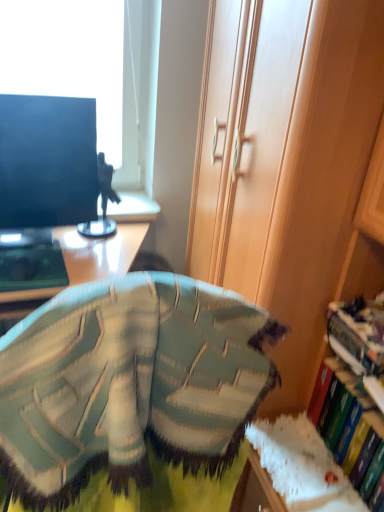
You are a GUI agent. You are given a task and a screenshot of the screen. Output one action in this format:
    pyautogui.click(x=<x>, y=<y>)
    Task: Click on the green knitted bean bag chair at center
    
    Given the screenshot: What is the action you would take?
    [x=132, y=396]

Where is `hardcover book at right, which is the 1th book in bottom-to-top order`? hardcover book at right, which is the 1th book in bottom-to-top order is located at coordinates (343, 409).

This screenshot has height=512, width=384. I want to click on green knitted bean bag chair at center, so click(x=132, y=396).

Locate an element on the screen. television behind the hardcover book at right, the second book when ordered from top to bottom is located at coordinates (47, 161).

Does matte black monitor at left have a smaller size compared to hardcover book at right, which is the 1th book in bottom-to-top order?

Actually, matte black monitor at left might be larger than hardcover book at right, which is the 1th book in bottom-to-top order.

Which is more to the left, matte black monitor at left or hardcover book at right, which is the 1th book in bottom-to-top order?

Positioned to the left is matte black monitor at left.

Which object is thinner, matte black monitor at left or hardcover book at right, the second book when ordered from top to bottom?

matte black monitor at left.

Considering the relative sizes of green knitted bean bag chair at center and matte black monitor at left in the image provided, is green knitted bean bag chair at center bigger than matte black monitor at left?

Indeed, green knitted bean bag chair at center has a larger size compared to matte black monitor at left.

Which point is more distant from viewer, (168,291) or (35,242)?

The point (35,242) is behind.

Would you say green knitted bean bag chair at center is outside matte black monitor at left?

Yes.

Which object is positioned more to the left, green knitted bean bag chair at center or matte black monitor at left?

matte black monitor at left.

Does wooden cabinet at right have a greater width compared to hardcover book at right, the first book positioned from the top?

Yes, wooden cabinet at right is wider than hardcover book at right, the first book positioned from the top.

Is point (300, 256) farther from viewer compared to point (363, 325)?

Yes, it is behind point (363, 325).

In terms of size, does wooden cabinet at right appear bigger or smaller than hardcover book at right, acting as the second book starting from the bottom?

Clearly, wooden cabinet at right is larger in size than hardcover book at right, acting as the second book starting from the bottom.

Is wooden cabinet at right positioned beyond the bounds of hardcover book at right, the first book positioned from the top?

That's correct, wooden cabinet at right is outside of hardcover book at right, the first book positioned from the top.

Looking at their sizes, would you say wooden cabinet at right is wider or thinner than green knitted bean bag chair at center?

wooden cabinet at right is wider than green knitted bean bag chair at center.

Does point (358, 250) lie in front of point (128, 419)?

That is False.

Is wooden cabinet at right turned away from green knitted bean bag chair at center?

Yes, wooden cabinet at right's orientation is away from green knitted bean bag chair at center.

From the image's perspective, is wooden cabinet at right above green knitted bean bag chair at center?

Yes, from the image's perspective, wooden cabinet at right is above green knitted bean bag chair at center.

Is green knitted bean bag chair at center positioned with its back to wooden cabinet at right?

green knitted bean bag chair at center is not turned away from wooden cabinet at right.

Would you say green knitted bean bag chair at center is outside wooden cabinet at right?

Yes, green knitted bean bag chair at center is not within wooden cabinet at right.

At what (x,y) coordinates should I click in order to perform the action: click on cabinetry on the right of the green knitted bean bag chair at center. Please return your answer as a coordinate pair (x, y). The height and width of the screenshot is (512, 384). Looking at the image, I should click on (324, 191).

Can you confirm if green knitted bean bag chair at center is positioned to the right of wooden cabinet at right?

In fact, green knitted bean bag chair at center is to the left of wooden cabinet at right.

Based on the photo, would you say matte black monitor at left is a long distance from wooden cabinet at right?

No, matte black monitor at left is in close proximity to wooden cabinet at right.

Between matte black monitor at left and wooden cabinet at right, which one appears on the right side from the viewer's perspective?

From the viewer's perspective, wooden cabinet at right appears more on the right side.

Between matte black monitor at left and wooden cabinet at right, which one has larger size?

wooden cabinet at right is bigger.

Where is `television above the wooden cabinet at right (from the image's perspective)`? television above the wooden cabinet at right (from the image's perspective) is located at coordinates (47, 161).

From a real-world perspective, does hardcover book at right, the second book when ordered from top to bottom, stand above hardcover book at right, acting as the second book starting from the bottom?

Incorrect, from a real-world perspective, hardcover book at right, the second book when ordered from top to bottom, is lower than hardcover book at right, acting as the second book starting from the bottom.

Is hardcover book at right, the second book when ordered from top to bottom, placed right next to hardcover book at right, the first book positioned from the top?

They are not placed beside each other.

Which object is thinner, hardcover book at right, the second book when ordered from top to bottom, or hardcover book at right, acting as the second book starting from the bottom?

hardcover book at right, the second book when ordered from top to bottom.

Who is bigger, hardcover book at right, the second book when ordered from top to bottom, or hardcover book at right, acting as the second book starting from the bottom?

With larger size is hardcover book at right, the second book when ordered from top to bottom.

You are a GUI agent. You are given a task and a screenshot of the screen. Output one action in this format:
    pyautogui.click(x=<x>, y=<y>)
    Task: Click on the 2nd book in front of the matte black monitor at left
    This screenshot has width=384, height=512.
    Given the screenshot: What is the action you would take?
    pyautogui.click(x=343, y=409)

You are a GUI agent. You are given a task and a screenshot of the screen. Output one action in this format:
    pyautogui.click(x=<x>, y=<y>)
    Task: Click on the bean bag chair located on the right of matte black monitor at left
    This screenshot has height=512, width=384.
    Given the screenshot: What is the action you would take?
    pyautogui.click(x=132, y=396)

Looking at this image, looking at the image, which one is located further to matte black monitor at left, hardcover book at right, acting as the second book starting from the bottom, or wooden cabinet at right?

The object further to matte black monitor at left is hardcover book at right, acting as the second book starting from the bottom.

Considering their positions, is wooden cabinet at right positioned further to green knitted bean bag chair at center than matte black monitor at left?

The object further to green knitted bean bag chair at center is matte black monitor at left.

Which object lies further to the anchor point hardcover book at right, the second book when ordered from top to bottom, matte black monitor at left or hardcover book at right, the first book positioned from the top?

Based on the image, matte black monitor at left appears to be further to hardcover book at right, the second book when ordered from top to bottom.

When comparing their distances from green knitted bean bag chair at center, does wooden cabinet at right or hardcover book at right, which is the 1th book in bottom-to-top order, seem closer?

Among the two, wooden cabinet at right is located nearer to green knitted bean bag chair at center.

When comparing their distances from hardcover book at right, acting as the second book starting from the bottom, does hardcover book at right, the second book when ordered from top to bottom, or wooden cabinet at right seem closer?

Based on the image, hardcover book at right, the second book when ordered from top to bottom, appears to be nearer to hardcover book at right, acting as the second book starting from the bottom.

Which object lies nearer to the anchor point matte black monitor at left, hardcover book at right, the second book when ordered from top to bottom, or hardcover book at right, the first book positioned from the top?

hardcover book at right, the first book positioned from the top, is closer to matte black monitor at left.

When comparing their distances from wooden cabinet at right, does green knitted bean bag chair at center or hardcover book at right, the second book when ordered from top to bottom, seem closer?

hardcover book at right, the second book when ordered from top to bottom.

Based on their spatial positions, is hardcover book at right, the second book when ordered from top to bottom, or wooden cabinet at right closer to matte black monitor at left?

wooden cabinet at right lies closer to matte black monitor at left than the other object.

What are the coordinates of `bean bag chair situated between matte black monitor at left and hardcover book at right, which is the 1th book in bottom-to-top order, from left to right` in the screenshot? It's located at (132, 396).

At what (x,y) coordinates should I click in order to perform the action: click on book between green knitted bean bag chair at center and wooden cabinet at right in the horizontal direction. Please return your answer as a coordinate pair (x, y). Looking at the image, I should click on (343, 409).

Where is `book located between wooden cabinet at right and hardcover book at right, acting as the second book starting from the bottom, in the depth direction`? This screenshot has height=512, width=384. book located between wooden cabinet at right and hardcover book at right, acting as the second book starting from the bottom, in the depth direction is located at coordinates (343, 409).

The width and height of the screenshot is (384, 512). I want to click on cabinetry between matte black monitor at left and hardcover book at right, acting as the second book starting from the bottom, from left to right, so click(x=324, y=191).